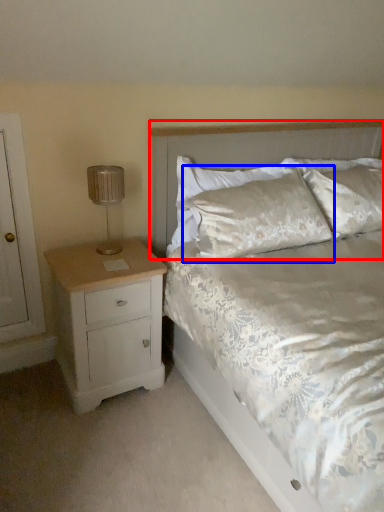
Question: Among these objects, which one is nearest to the camera, headboard (highlighted by a red box) or pillow (highlighted by a blue box)?

Choices:
 (A) headboard
 (B) pillow

Answer: (A)